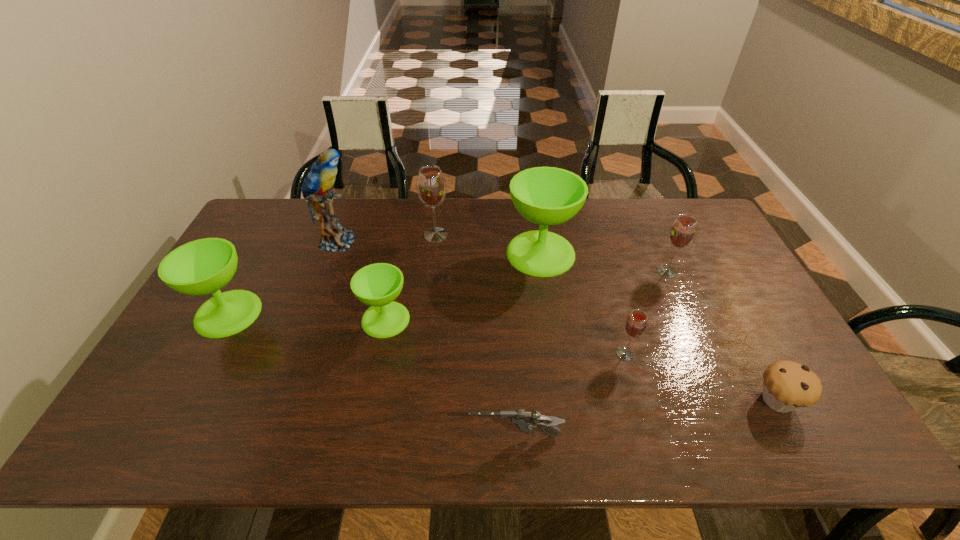
Where is `vacant area that lies between the gun and the biggest red wineglass`? The width and height of the screenshot is (960, 540). vacant area that lies between the gun and the biggest red wineglass is located at coordinates (475, 336).

This screenshot has height=540, width=960. I want to click on empty space that is in between the biggest red wineglass and the smallest red wineglass, so coord(531,294).

Find the location of a particular element. The height and width of the screenshot is (540, 960). free space that is in between the parrot and the leftmost red wineglass is located at coordinates (386, 238).

The image size is (960, 540). Identify the location of free area in between the biggest green wineglass and the seventh farthest object. (583, 303).

This screenshot has height=540, width=960. Find the location of `free space between the parrot and the second farthest red wineglass`. free space between the parrot and the second farthest red wineglass is located at coordinates (502, 256).

Image resolution: width=960 pixels, height=540 pixels. In order to click on vacant area between the tallest object and the muffin in this screenshot , I will do `click(557, 321)`.

Where is `vacant area that lies between the leftmost red wineglass and the eighth farthest object`? The image size is (960, 540). vacant area that lies between the leftmost red wineglass and the eighth farthest object is located at coordinates (607, 318).

This screenshot has height=540, width=960. Identify the location of vacant area between the nearest object and the leftmost wineglass. (372, 375).

Where is `object that is the eighth closest to the nearest object`? object that is the eighth closest to the nearest object is located at coordinates (316, 186).

Find the location of a particular element. This screenshot has width=960, height=540. object that stands as the sixth closest to the rightmost green wineglass is located at coordinates (524, 421).